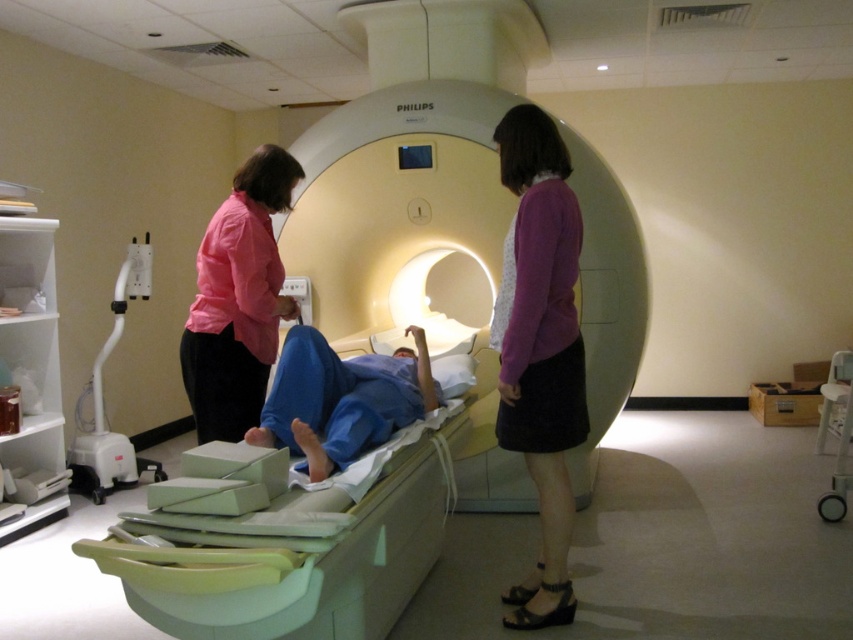
You are a nurse entering the MRI room and need to locate the pink fabric shirt at left and the white plastic oxygen tank at left. Based on their positions, which object is closer to the MRI machine?

The pink fabric shirt at left is to the right of the white plastic oxygen tank at left, so the white plastic oxygen tank at left is closer to the MRI machine.

You are a technician in the MRI room. You need to place two markers at the coordinates point (517,148) and point (846,442). According to the scene description, which marker is closer to the MRI scanner entrance?

Point (517,148) is in front of point (846,442), so the marker at point (517,148) is closer to the MRI scanner entrance.

You are a medical technician standing 10 feet away from the MRI machine. You need to retrieve the purple fabric skirt at center. Can you reach it without moving closer?

The purple fabric skirt at center is 7.88 feet from the camera. Since you are 10 feet away from the MRI machine, you cannot reach the skirt without moving closer because it is farther than your current distance.